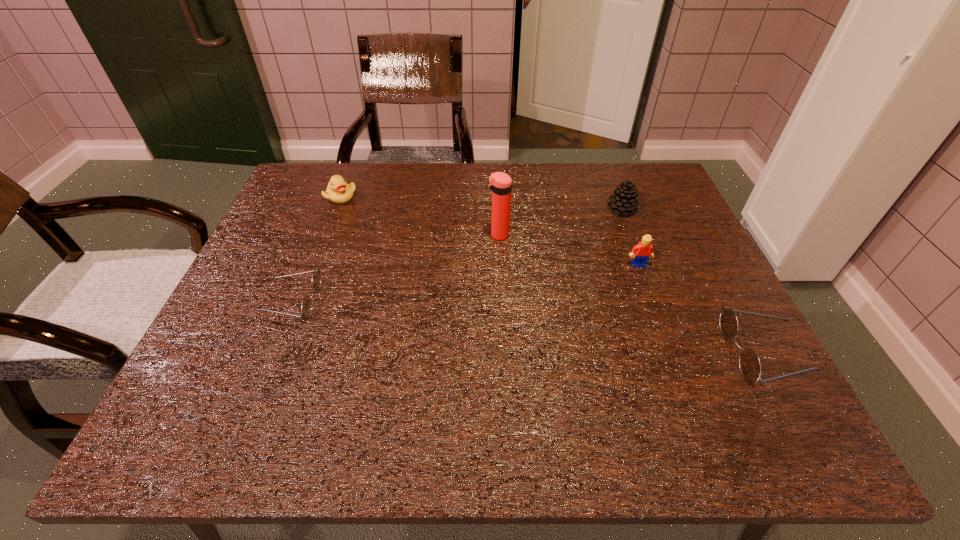
Find the location of a particular element. This screenshot has width=960, height=540. spectacles that is at the right edge is located at coordinates (750, 367).

The image size is (960, 540). What are the coordinates of `pinecone situated at the right edge` in the screenshot? It's located at (x=624, y=199).

Find the location of a particular element. The height and width of the screenshot is (540, 960). Lego positioned at the right edge is located at coordinates (644, 249).

Identify the location of object located at the far left corner. The width and height of the screenshot is (960, 540). (338, 191).

The image size is (960, 540). What are the coordinates of `object present at the far right corner` in the screenshot? It's located at (624, 199).

Locate an element on the screen. The height and width of the screenshot is (540, 960). object at the near right corner is located at coordinates (750, 367).

Find the location of a particular element. The width and height of the screenshot is (960, 540). free space at the far edge is located at coordinates (360, 169).

The height and width of the screenshot is (540, 960). I want to click on free space at the near edge, so click(x=545, y=356).

This screenshot has width=960, height=540. Find the location of `vacant point at the left edge`. vacant point at the left edge is located at coordinates (293, 233).

Find the location of `vacant region at the right edge of the desktop`. vacant region at the right edge of the desktop is located at coordinates (683, 332).